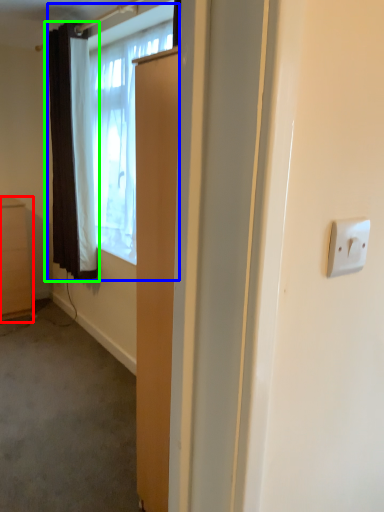
Question: Which is nearer to the cabinetry (highlighted by a red box)? window (highlighted by a blue box) or curtain (highlighted by a green box).

Choices:
 (A) window
 (B) curtain

Answer: (B)